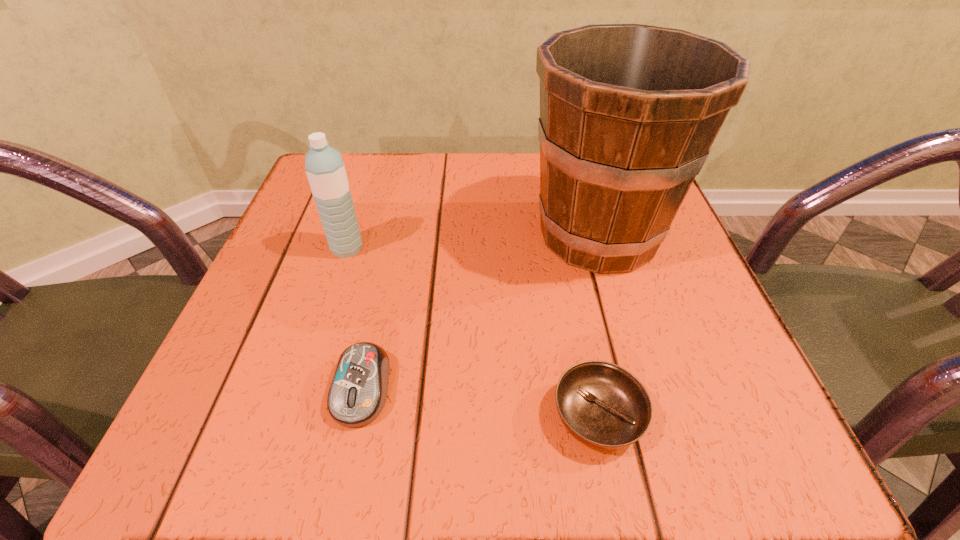
This screenshot has width=960, height=540. Find the location of `free region at the far left corner of the desktop`. free region at the far left corner of the desktop is located at coordinates (301, 214).

At what (x,y) coordinates should I click in order to perform the action: click on free space at the near right corner. Please return your answer as a coordinate pair (x, y). Looking at the image, I should click on (712, 406).

Locate an element on the screen. This screenshot has width=960, height=540. free space between the soup bowl and the second object from left to right is located at coordinates point(480,402).

At what (x,y) coordinates should I click in order to perform the action: click on vacant space that's between the computer mouse and the bucket. Please return your answer as a coordinate pair (x, y). Image resolution: width=960 pixels, height=540 pixels. Looking at the image, I should click on (480, 312).

This screenshot has width=960, height=540. I want to click on vacant area that lies between the bucket and the computer mouse, so click(x=480, y=312).

Locate an element on the screen. This screenshot has height=540, width=960. vacant point located between the second object from left to right and the tallest object is located at coordinates (480, 312).

Find the location of a particular element. This screenshot has width=960, height=540. free space between the bucket and the leftmost object is located at coordinates (472, 242).

I want to click on vacant region between the second object from left to right and the tallest object, so click(480, 312).

Find the location of a particular element. free space between the second object from left to right and the bucket is located at coordinates (480, 312).

Locate an element on the screen. Image resolution: width=960 pixels, height=540 pixels. free space between the leftmost object and the soup bowl is located at coordinates (472, 332).